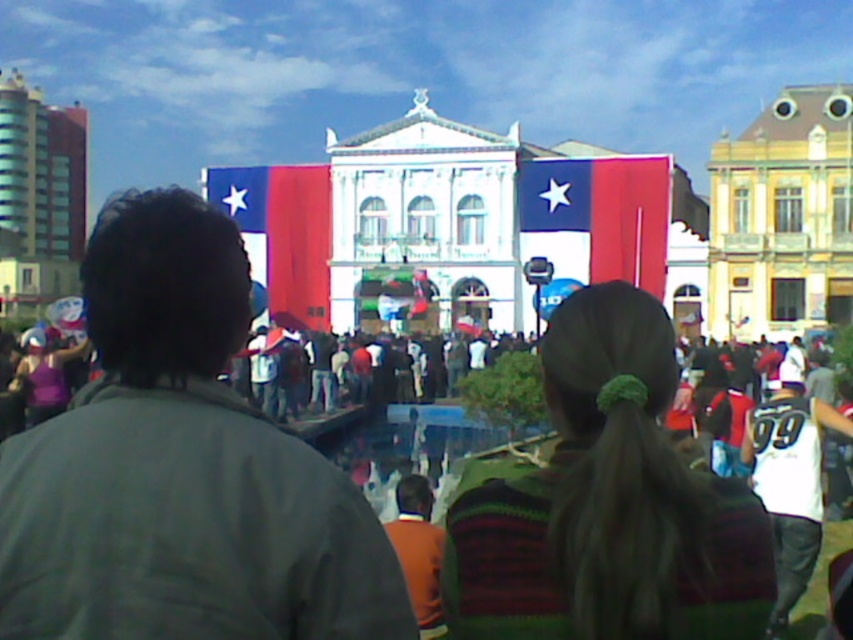
Question: Is the position of green knitted sweater at center more distant than that of matte fabric flag at center?

Choices:
 (A) yes
 (B) no

Answer: (B)

Question: Which point is farther to the camera?

Choices:
 (A) matte red flag at center
 (B) green knitted sweater at center
 (C) dark green jacket at center

Answer: (A)

Question: Based on their relative distances, which object is farther from the dark green jacket at center?

Choices:
 (A) matte fabric flag at center
 (B) matte red flag at center

Answer: (B)

Question: Can you confirm if dark green jacket at center is thinner than matte red flag at center?

Choices:
 (A) no
 (B) yes

Answer: (A)

Question: Which point appears closest to the camera in this image?

Choices:
 (A) (587, 237)
 (B) (306, 172)
 (C) (99, 636)

Answer: (C)

Question: Does dark green jacket at center appear under matte red flag at center?

Choices:
 (A) yes
 (B) no

Answer: (A)